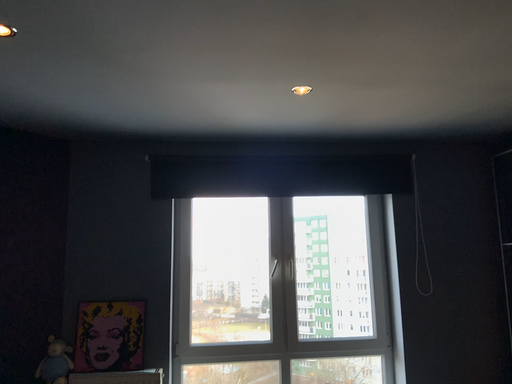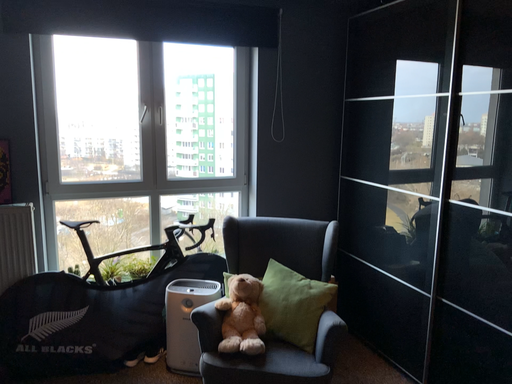
Question: Which way did the camera rotate in the video?

Choices:
 (A) rotated right
 (B) rotated left

Answer: (A)